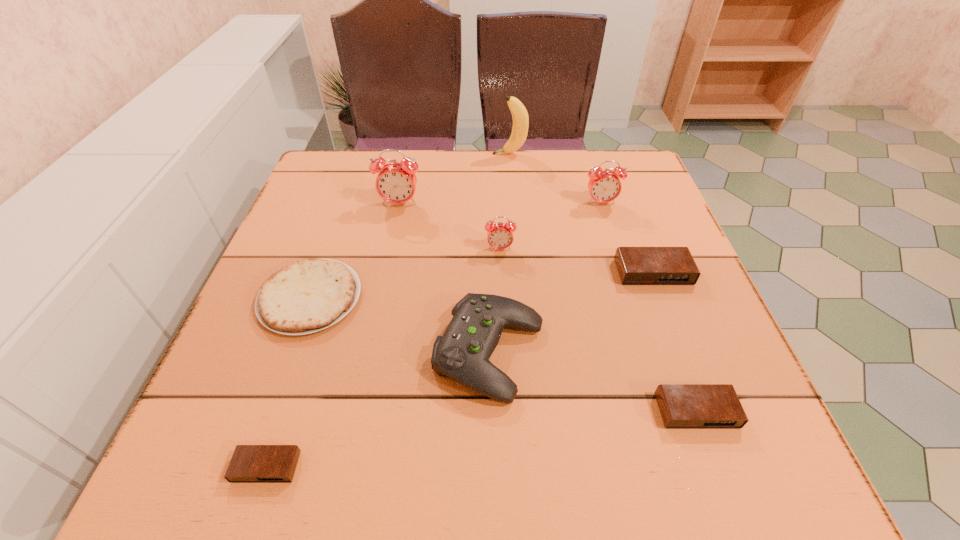
Locate an element on the screen. The width and height of the screenshot is (960, 540). red alarm clock that is the second nearest to the control is located at coordinates (396, 183).

Point out which black alarm clock is positioned as the second nearest to the second farthest black alarm clock. Please provide its 2D coordinates. Your answer should be formatted as a tuple, i.e. [(x, y)], where the tuple contains the x and y coordinates of a point satisfying the conditions above.

[(250, 463)]

Identify the location of black alarm clock that is the second closest to the farthest black alarm clock. The height and width of the screenshot is (540, 960). (250, 463).

Find the location of `free space that satisfies the following two spatial constraints: 1. from the stem of the banana; 2. on the front face of the shortest object`. free space that satisfies the following two spatial constraints: 1. from the stem of the banana; 2. on the front face of the shortest object is located at coordinates (537, 467).